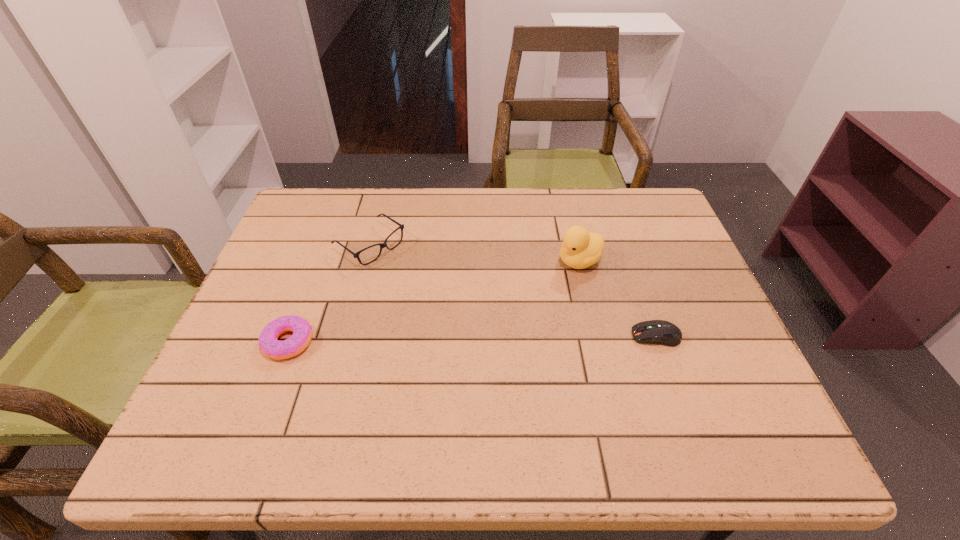
Image resolution: width=960 pixels, height=540 pixels. I want to click on vacant region that satisfies the following two spatial constraints: 1. on the back side of the doughnut; 2. on the button of the computer equipment, so click(x=291, y=336).

The width and height of the screenshot is (960, 540). In order to click on vacant area in the image that satisfies the following two spatial constraints: 1. on the back side of the computer equipment; 2. on the button of the doughnut in this screenshot , I will do `click(291, 336)`.

Find the location of a particular element. This screenshot has width=960, height=540. free space that satisfies the following two spatial constraints: 1. on the back side of the doughnut; 2. on the right side of the tallest object is located at coordinates (319, 261).

You are a GUI agent. You are given a task and a screenshot of the screen. Output one action in this format:
    pyautogui.click(x=<x>, y=<y>)
    Task: Click on the vacant space that satisfies the following two spatial constraints: 1. on the back side of the third object from left to right; 2. on the left side of the doughnut
    
    Given the screenshot: What is the action you would take?
    pyautogui.click(x=319, y=261)